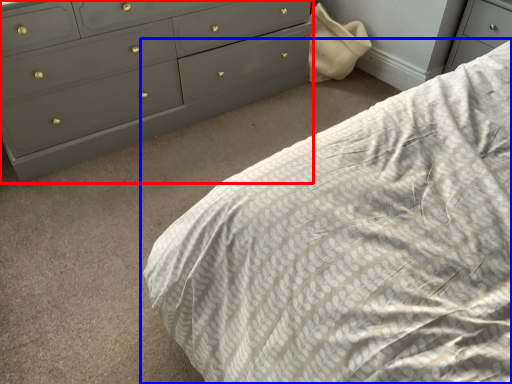
Question: Which of the following is the farthest to the observer, chest of drawers (highlighted by a red box) or bed (highlighted by a blue box)?

Choices:
 (A) chest of drawers
 (B) bed

Answer: (A)